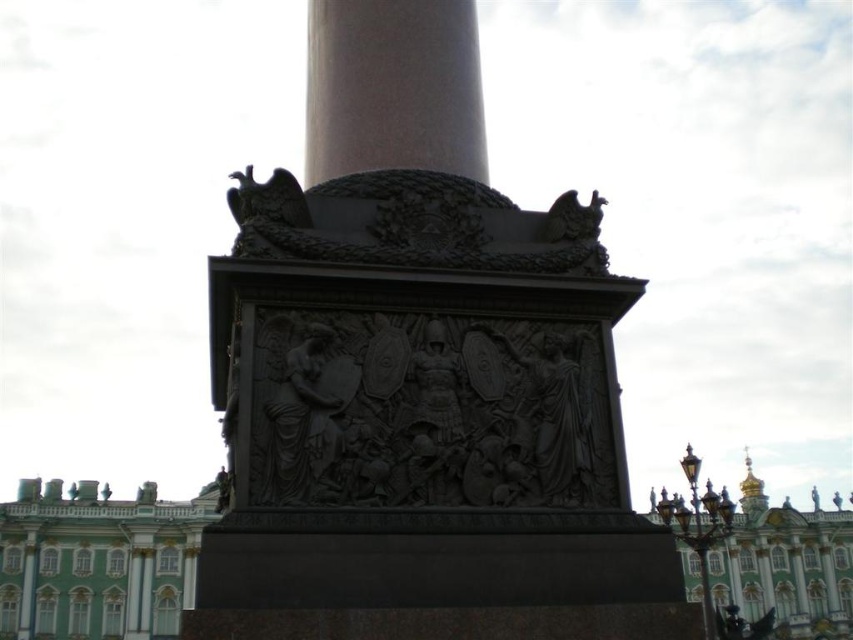
You are an architect examining the monument. You need to determine the spatial relationship between the smooth bronze column at center and the green polished stone palace at lower left. Which object is closer to the viewer?

The smooth bronze column at center is closer to the viewer than the green polished stone palace at lower left because it is positioned in front of it.